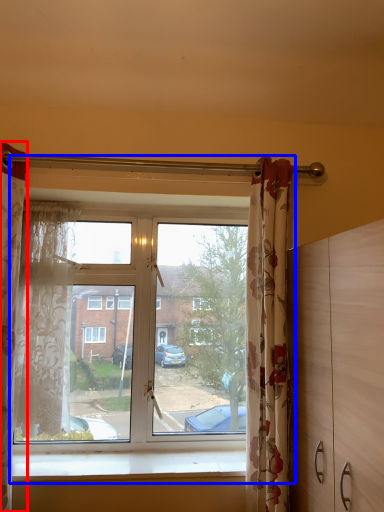
Question: Which point is further to the camera, curtain (highlighted by a red box) or window (highlighted by a blue box)?

Choices:
 (A) curtain
 (B) window

Answer: (B)